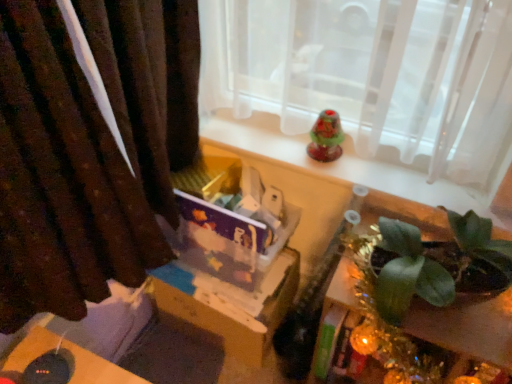
Locate an element on the screen. green leafy plant at lower right is located at coordinates (403, 210).

Is cardboard box at center not close to green leafy plant at lower right?

cardboard box at center is near green leafy plant at lower right, not far away.

From a real-world perspective, who is located lower, cardboard box at center or green leafy plant at lower right?

cardboard box at center is physically lower.

From the image's perspective, is cardboard box at center above green leafy plant at lower right?

Yes, from the image's perspective, cardboard box at center is above green leafy plant at lower right.

Can you tell me how much brown velvet curtain at left and green leafy plant at lower right differ in facing direction?

brown velvet curtain at left and green leafy plant at lower right are facing 89.2 degrees away from each other.

Identify the location of table on the right side of brown velvet curtain at left. (403, 210).

Which is in front, point (42, 56) or point (444, 217)?

The point (42, 56) is more forward.

From the image's perspective, is brown velvet curtain at left beneath green leafy plant at lower right?

Incorrect, from the image's perspective, brown velvet curtain at left is higher than green leafy plant at lower right.

Which of these two, green leafy plant at lower right or cardboard box at center, stands shorter?

cardboard box at center is shorter.

From the image's perspective, is green leafy plant at lower right positioned above or below cardboard box at center?

Based on their image positions, green leafy plant at lower right is located beneath cardboard box at center.

Considering the relative sizes of green leafy plant at lower right and cardboard box at center in the image provided, is green leafy plant at lower right wider than cardboard box at center?

Yes.

Which point is more forward, (435, 333) or (206, 309)?

Positioned in front is point (435, 333).

This screenshot has height=384, width=512. Find the location of `cardboard box that is on the left side of translucent glass bell at upper center`. cardboard box that is on the left side of translucent glass bell at upper center is located at coordinates (228, 305).

Is translucent glass bell at upper center surrounded by cardboard box at center?

Definitely not — translucent glass bell at upper center is not inside cardboard box at center.

From the picture: Considering the sizes of objects cardboard box at center and translucent glass bell at upper center in the image provided, who is bigger, cardboard box at center or translucent glass bell at upper center?

cardboard box at center.

How different are the orientations of cardboard box at center and translucent glass bell at upper center in degrees?

The facing directions of cardboard box at center and translucent glass bell at upper center are 0.537 degrees apart.

Is point (45, 211) farther from viewer compared to point (330, 155)?

No, (45, 211) is in front of (330, 155).

In the scene shown: From the image's perspective, between brown velvet curtain at left and translucent glass bell at upper center, which one is located above?

translucent glass bell at upper center.

Is brown velvet curtain at left looking in the opposite direction of translucent glass bell at upper center?

No.

Between brown velvet curtain at left and translucent glass bell at upper center, which one appears on the left side from the viewer's perspective?

From the viewer's perspective, brown velvet curtain at left appears more on the left side.

Does brown velvet curtain at left touch cardboard box at center?

No.

From a real-world perspective, between brown velvet curtain at left and cardboard box at center, who is vertically lower?

In real-world perspective, cardboard box at center is lower.

Would you say brown velvet curtain at left is outside cardboard box at center?

Yes, brown velvet curtain at left is outside of cardboard box at center.

Is brown velvet curtain at left positioned with its back to cardboard box at center?

brown velvet curtain at left is not turned away from cardboard box at center.

Based on the photo, is translucent glass bell at upper center wider or thinner than cardboard box at center?

Considering their sizes, translucent glass bell at upper center looks slimmer than cardboard box at center.

Consider the image. Is translucent glass bell at upper center located outside cardboard box at center?

Yes.

From a real-world perspective, is translucent glass bell at upper center located beneath cardboard box at center?

No, from a real-world perspective, translucent glass bell at upper center is not under cardboard box at center.

Does translucent glass bell at upper center have a larger size compared to cardboard box at center?

No.

The height and width of the screenshot is (384, 512). Find the location of `table that is above the cardboard box at center (from a real-world perspective)`. table that is above the cardboard box at center (from a real-world perspective) is located at coordinates (403, 210).

The image size is (512, 384). Identify the location of curtain that appears in front of the green leafy plant at lower right. (90, 148).

Estimate the real-world distances between objects in this image. Which object is closer to cardboard box at center, brown velvet curtain at left or translucent glass bell at upper center?

Among the two, brown velvet curtain at left is located nearer to cardboard box at center.

In the scene shown: Looking at the image, which one is located closer to green leafy plant at lower right, cardboard box at center or brown velvet curtain at left?

Based on the image, cardboard box at center appears to be nearer to green leafy plant at lower right.

From the picture: From the image, which object appears to be farther from brown velvet curtain at left, green leafy plant at lower right or translucent glass bell at upper center?

green leafy plant at lower right is further to brown velvet curtain at left.

Considering their positions, is green leafy plant at lower right positioned closer to translucent glass bell at upper center than brown velvet curtain at left?

The object closer to translucent glass bell at upper center is green leafy plant at lower right.

Estimate the real-world distances between objects in this image. Which object is closer to translucent glass bell at upper center, green leafy plant at lower right or cardboard box at center?

green leafy plant at lower right is closer to translucent glass bell at upper center.

From the picture: Considering their positions, is green leafy plant at lower right positioned further to cardboard box at center than translucent glass bell at upper center?

Based on the image, translucent glass bell at upper center appears to be further to cardboard box at center.

Based on their spatial positions, is brown velvet curtain at left or cardboard box at center further from translucent glass bell at upper center?

The object further to translucent glass bell at upper center is brown velvet curtain at left.

Based on their spatial positions, is translucent glass bell at upper center or green leafy plant at lower right closer to cardboard box at center?

green leafy plant at lower right.

The image size is (512, 384). Identify the location of toy between brown velvet curtain at left and green leafy plant at lower right. (326, 137).

The height and width of the screenshot is (384, 512). I want to click on toy located between brown velvet curtain at left and cardboard box at center in the depth direction, so click(x=326, y=137).

You are a GUI agent. You are given a task and a screenshot of the screen. Output one action in this format:
    pyautogui.click(x=<x>, y=<y>)
    Task: Click on the cardboard box situated between brown velvet curtain at left and green leafy plant at lower right from left to right
    
    Given the screenshot: What is the action you would take?
    pyautogui.click(x=228, y=305)

This screenshot has height=384, width=512. I want to click on cardboard box between translucent glass bell at upper center and green leafy plant at lower right from top to bottom, so [x=228, y=305].